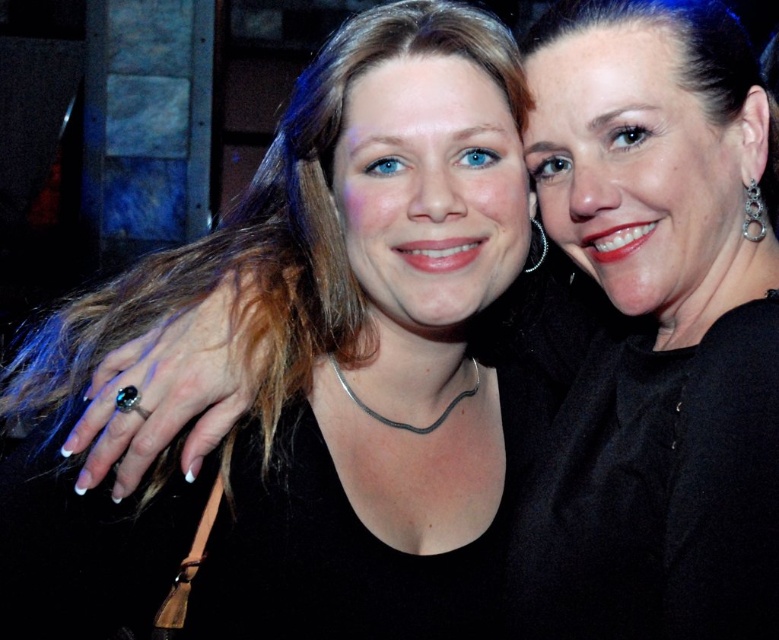
Question: Does black matte necklace at center have a lesser width compared to black matte dress at center?

Choices:
 (A) yes
 (B) no

Answer: (B)

Question: Can you confirm if black matte necklace at center is positioned below black matte dress at center?

Choices:
 (A) yes
 (B) no

Answer: (A)

Question: Which of the following is the closest to the observer?

Choices:
 (A) (404, 145)
 (B) (619, 272)

Answer: (B)

Question: Can you confirm if black matte necklace at center is positioned above black matte dress at center?

Choices:
 (A) no
 (B) yes

Answer: (A)

Question: Which point appears closest to the camera in this image?

Choices:
 (A) (612, 627)
 (B) (12, 618)

Answer: (B)